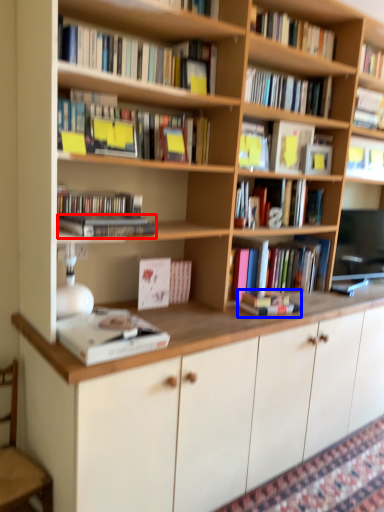
Question: Which point is closer to the camera, book (highlighted by a red box) or book (highlighted by a blue box)?

Choices:
 (A) book
 (B) book

Answer: (A)